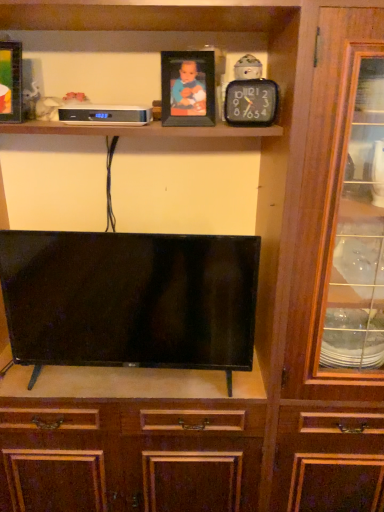
Question: Is wooden photo frame at upper center, the second picture frame from the left, thinner than black glossy tv at center?

Choices:
 (A) yes
 (B) no

Answer: (A)

Question: Does wooden photo frame at upper center, which is counted as the first picture frame, starting from the right, have a lesser height compared to black glossy tv at center?

Choices:
 (A) yes
 (B) no

Answer: (A)

Question: Are wooden photo frame at upper center, the second picture frame from the left, and black glossy tv at center far apart?

Choices:
 (A) yes
 (B) no

Answer: (B)

Question: Considering the relative sizes of wooden photo frame at upper center, the second picture frame from the left, and black glossy tv at center in the image provided, is wooden photo frame at upper center, the second picture frame from the left, taller than black glossy tv at center?

Choices:
 (A) yes
 (B) no

Answer: (B)

Question: From the image's perspective, is wooden photo frame at upper center, the second picture frame from the left, beneath black glossy tv at center?

Choices:
 (A) yes
 (B) no

Answer: (B)

Question: Do you think white plastic clock at upper center is within black glossy tv at center, or outside of it?

Choices:
 (A) inside
 (B) outside

Answer: (B)

Question: Is white plastic clock at upper center taller or shorter than black glossy tv at center?

Choices:
 (A) short
 (B) tall

Answer: (A)

Question: Is white plastic clock at upper center to the left or to the right of black glossy tv at center in the image?

Choices:
 (A) left
 (B) right

Answer: (A)

Question: In terms of size, does white plastic clock at upper center appear bigger or smaller than black glossy tv at center?

Choices:
 (A) big
 (B) small

Answer: (B)

Question: Considering the positions of white plastic clock at upper center and matte black picture frame at upper left, positioned as the 2th picture frame in right-to-left order, in the image, is white plastic clock at upper center taller or shorter than matte black picture frame at upper left, positioned as the 2th picture frame in right-to-left order,?

Choices:
 (A) tall
 (B) short

Answer: (B)

Question: From the image's perspective, is white plastic clock at upper center located above or below matte black picture frame at upper left, positioned as the 2th picture frame in right-to-left order?

Choices:
 (A) below
 (B) above

Answer: (A)

Question: Considering the positions of point (86, 123) and point (18, 73), is point (86, 123) closer or farther from the camera than point (18, 73)?

Choices:
 (A) closer
 (B) farther

Answer: (A)

Question: Is white plastic clock at upper center wider or thinner than matte black picture frame at upper left, positioned as the 2th picture frame in right-to-left order?

Choices:
 (A) thin
 (B) wide

Answer: (B)

Question: From the image's perspective, is black plastic clock at upper center positioned above or below white plastic clock at upper center?

Choices:
 (A) below
 (B) above

Answer: (B)

Question: From a real-world perspective, is black plastic clock at upper center physically located above or below white plastic clock at upper center?

Choices:
 (A) above
 (B) below

Answer: (A)